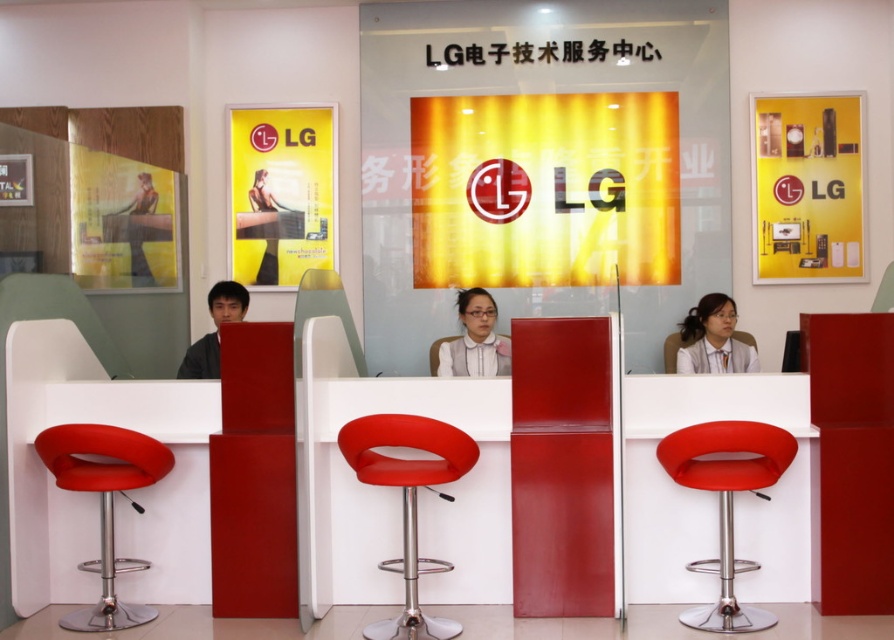
Who is positioned more to the left, matte white blouse at center or smooth red stool at center?

Positioned to the left is smooth red stool at center.

This screenshot has height=640, width=894. Describe the element at coordinates (713, 339) in the screenshot. I see `matte white blouse at center` at that location.

Identify the location of matte white blouse at center. (713, 339).

Does matte red bar stool at lower right lie in front of matte red stool at center?

Yes, it is in front of matte red stool at center.

Does matte red bar stool at lower right have a larger size compared to matte red stool at center?

Indeed, matte red bar stool at lower right has a larger size compared to matte red stool at center.

Is point (664, 458) positioned behind point (671, 358)?

No, it is in front of (671, 358).

Image resolution: width=894 pixels, height=640 pixels. Identify the location of matte red bar stool at lower right. (726, 502).

Is matte red bar stool at lower right positioned at the back of smooth red stool at center?

No.

Where is `matte red bar stool at lower right`? The image size is (894, 640). matte red bar stool at lower right is located at coordinates (726, 502).